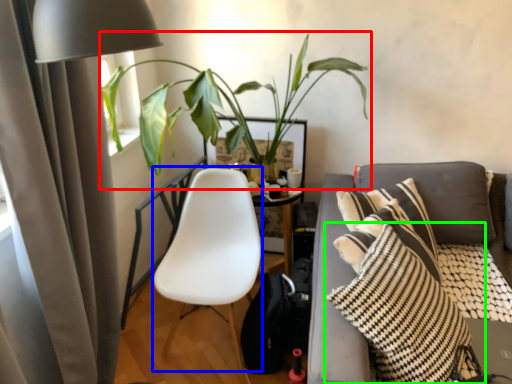
Question: Based on their relative distances, which object is nearer to houseplant (highlighted by a red box)? Choose from rocking chair (highlighted by a blue box) and pillow (highlighted by a green box).

Choices:
 (A) rocking chair
 (B) pillow

Answer: (A)